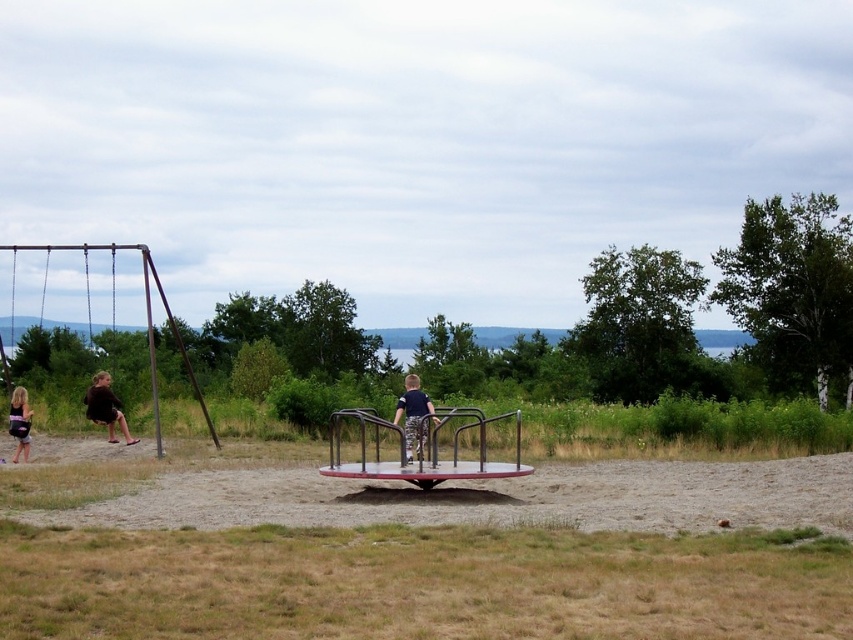
Is smooth sand at center smaller than metallic swing at left?

Yes, smooth sand at center is smaller than metallic swing at left.

Does point (334, 490) come farther from viewer compared to point (103, 404)?

No.

Locate an element on the screen. Image resolution: width=853 pixels, height=640 pixels. smooth sand at center is located at coordinates (496, 497).

Who is more forward, (x=103, y=417) or (x=27, y=442)?

Point (x=27, y=442) is in front.

Is dark brown fabric pants at left thinner than matte black shorts at lower left?

Indeed, dark brown fabric pants at left has a lesser width compared to matte black shorts at lower left.

Which is in front, point (88, 401) or point (16, 387)?

Point (88, 401)

The height and width of the screenshot is (640, 853). In order to click on dark brown fabric pants at left in this screenshot , I will do `click(105, 406)`.

Is smooth sand at center below matte black shorts at lower left?

Yes.

Which is more to the left, smooth sand at center or matte black shorts at lower left?

From the viewer's perspective, matte black shorts at lower left appears more on the left side.

Find the location of a particular element. The width and height of the screenshot is (853, 640). smooth sand at center is located at coordinates (496, 497).